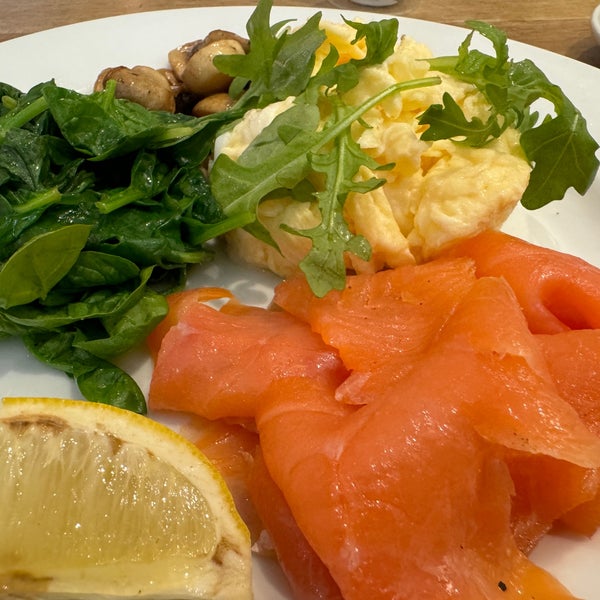
The height and width of the screenshot is (600, 600). What are the coordinates of `table` in the screenshot? It's located at (57, 10), (499, 15).